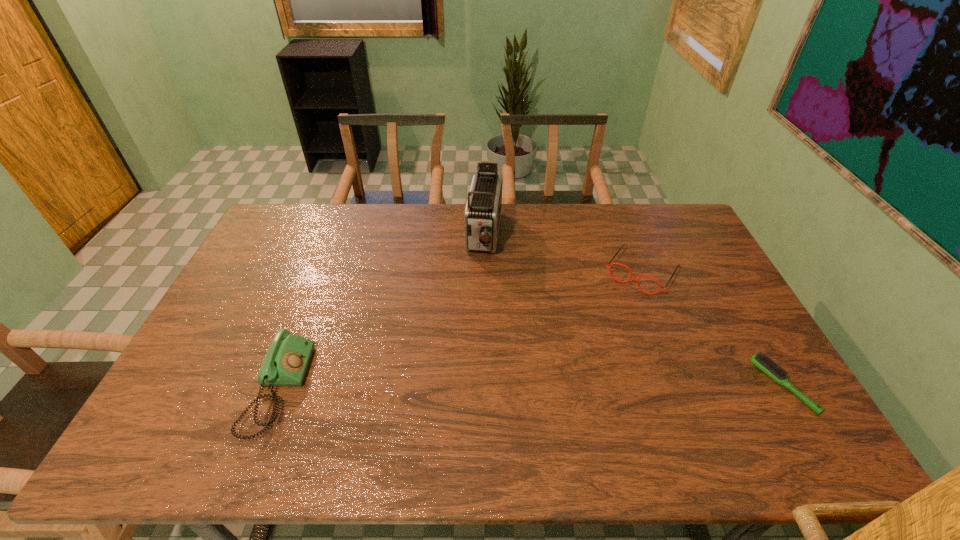
Where is `vacant space on the desktop that is between the leftmost object and the shortest object and is positioned on the front-facing side of the third tallest object`? vacant space on the desktop that is between the leftmost object and the shortest object and is positioned on the front-facing side of the third tallest object is located at coordinates (564, 387).

Where is `vacant space on the desktop that is between the third shortest object and the shortest object and is positioned at the lens of the tallest object`? vacant space on the desktop that is between the third shortest object and the shortest object and is positioned at the lens of the tallest object is located at coordinates (458, 388).